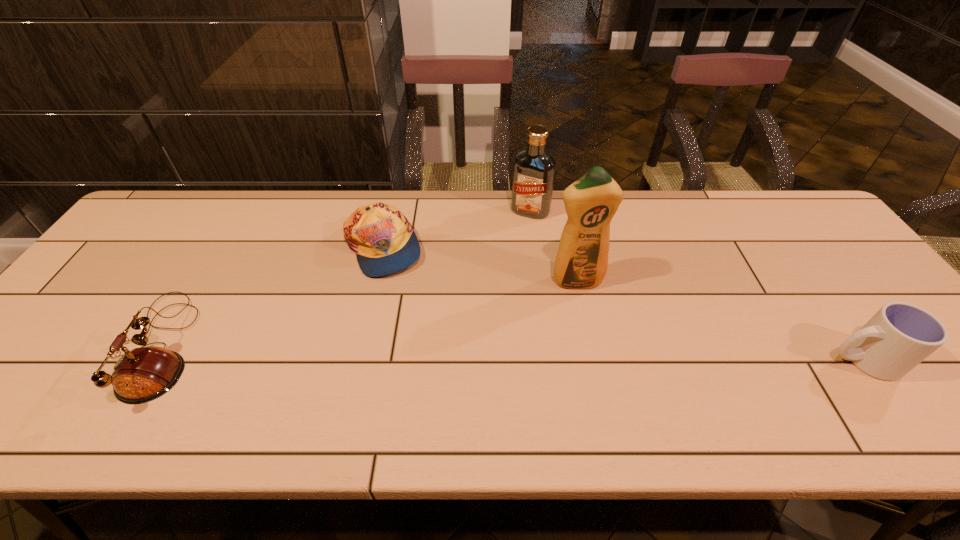
Locate an element on the screen. The height and width of the screenshot is (540, 960). free region located 0.070m with the handle on the side of the rightmost object is located at coordinates (796, 360).

At what (x,y) coordinates should I click in order to perform the action: click on blank area located on the label of the tallest object. Please return your answer as a coordinate pair (x, y). The image size is (960, 540). Looking at the image, I should click on (611, 375).

Identify the location of vacant space located on the label of the tallest object. The height and width of the screenshot is (540, 960). (609, 367).

Find the location of `vacant region located on the label of the tallest object`. vacant region located on the label of the tallest object is located at coordinates (602, 349).

In order to click on free space located on the front-facing side of the second tallest object in this screenshot , I will do `click(490, 286)`.

Where is `free point located 0.320m on the front-facing side of the second tallest object`? The image size is (960, 540). free point located 0.320m on the front-facing side of the second tallest object is located at coordinates (487, 291).

Identify the location of vacant area located on the front-facing side of the second tallest object. The image size is (960, 540). (517, 231).

In order to click on vacant point located 0.150m on the bill of the cap in this screenshot , I will do `click(454, 290)`.

Locate an element on the screen. blank area located 0.330m on the bill of the cap is located at coordinates (512, 323).

This screenshot has height=540, width=960. Find the location of `vacant space located 0.180m on the bill of the cap`. vacant space located 0.180m on the bill of the cap is located at coordinates (464, 295).